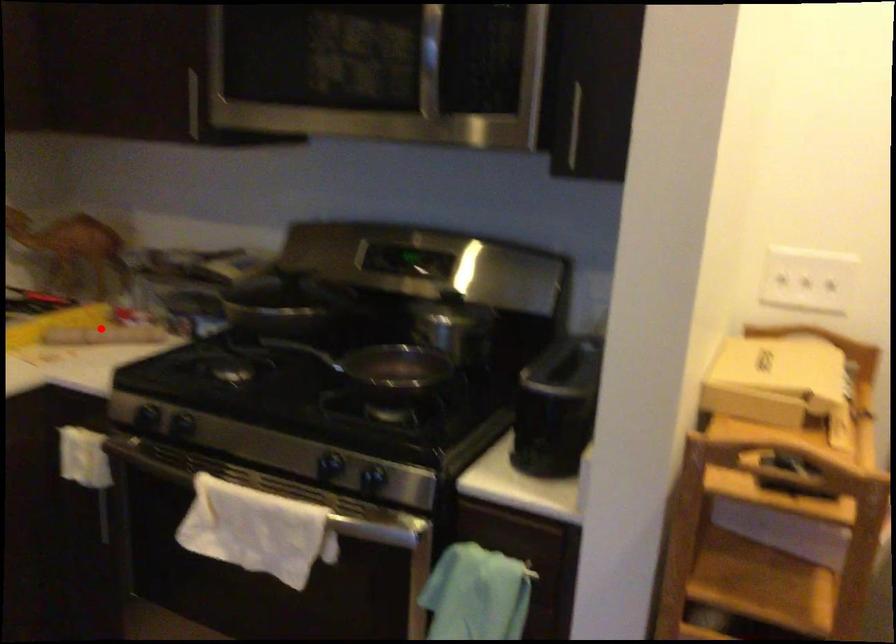
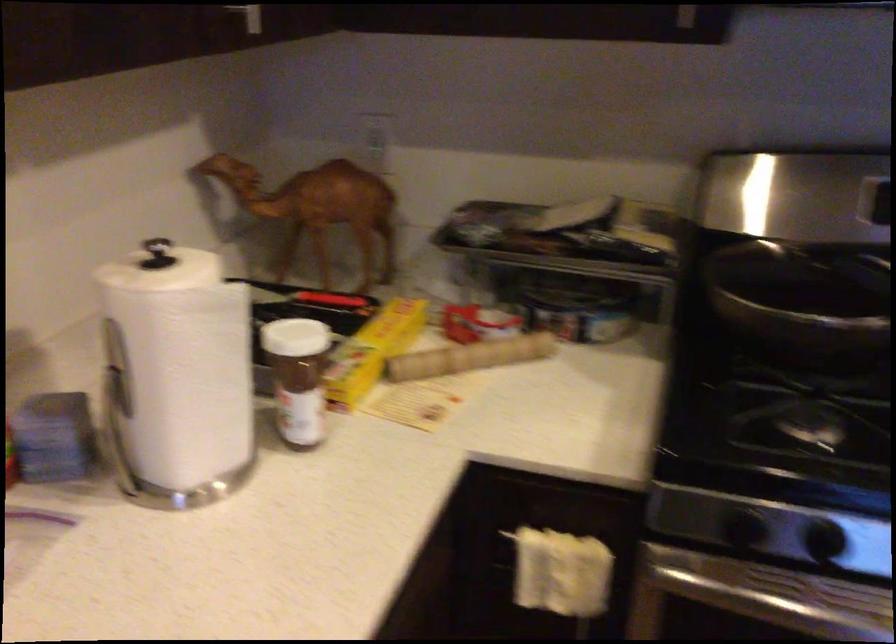
Question: I am providing you with two images of the same scene from different viewpoints. In image1, a red point is highlighted. Considering the same 3D point in image2, which of the following is correct?

Choices:
 (A) It is closer
 (B) It is farther

Answer: (A)